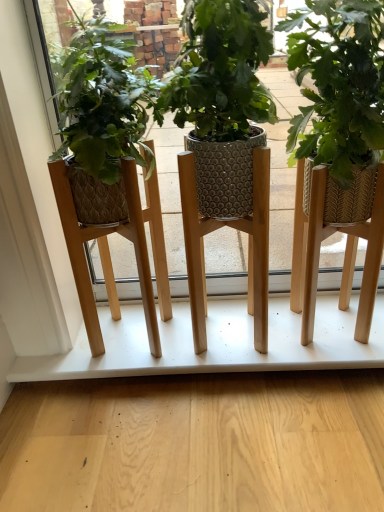
Locate an element on the screen. Image resolution: width=384 pixels, height=512 pixels. free space above white matte shelf at center (from a real-world perspective) is located at coordinates (214, 335).